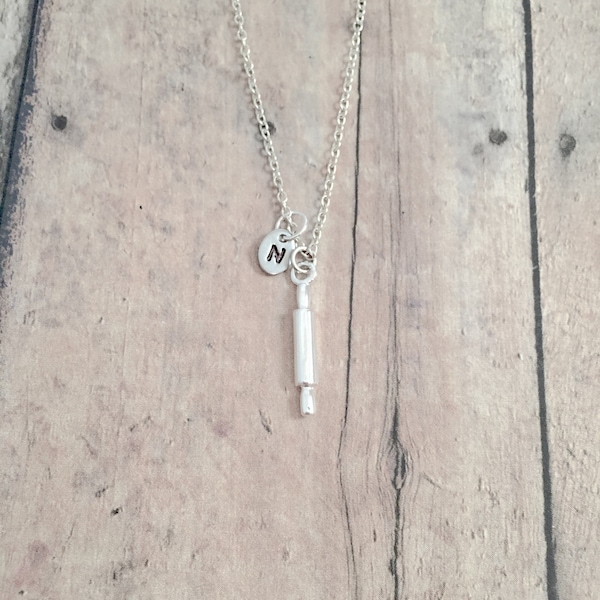
Locate an element on the screen. The height and width of the screenshot is (600, 600). round pendant is located at coordinates (265, 270).